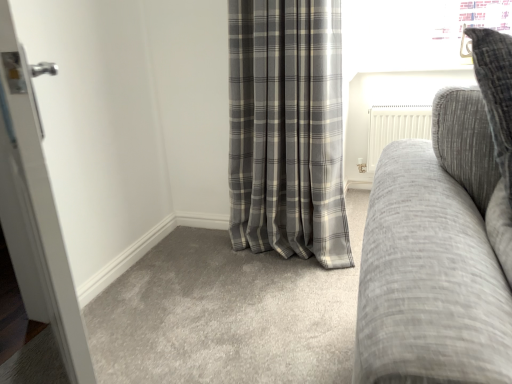
Question: Is gray plaid curtain at center wider than textured gray couch at right?

Choices:
 (A) yes
 (B) no

Answer: (B)

Question: Is gray plaid curtain at center facing towards textured gray couch at right?

Choices:
 (A) yes
 (B) no

Answer: (B)

Question: From a real-world perspective, is gray plaid curtain at center beneath textured gray couch at right?

Choices:
 (A) no
 (B) yes

Answer: (B)

Question: Is gray plaid curtain at center far away from textured gray couch at right?

Choices:
 (A) no
 (B) yes

Answer: (B)

Question: Can you confirm if gray plaid curtain at center is thinner than textured gray couch at right?

Choices:
 (A) yes
 (B) no

Answer: (A)

Question: From their relative heights in the image, would you say textured gray couch at right is taller or shorter than gray plaid curtain at center?

Choices:
 (A) tall
 (B) short

Answer: (B)

Question: Does point (382, 263) appear closer or farther from the camera than point (242, 112)?

Choices:
 (A) closer
 (B) farther

Answer: (A)

Question: From a real-world perspective, is textured gray couch at right positioned above or below gray plaid curtain at center?

Choices:
 (A) below
 (B) above

Answer: (B)

Question: Is textured gray couch at right inside the boundaries of gray plaid curtain at center, or outside?

Choices:
 (A) outside
 (B) inside

Answer: (A)

Question: In the image, is white glossy door at left positioned in front of or behind textured gray couch at right?

Choices:
 (A) behind
 (B) front

Answer: (A)

Question: Is white glossy door at left inside the boundaries of textured gray couch at right, or outside?

Choices:
 (A) inside
 (B) outside

Answer: (B)

Question: Does point (48, 256) appear closer or farther from the camera than point (456, 243)?

Choices:
 (A) closer
 (B) farther

Answer: (B)

Question: Looking at their shapes, would you say white glossy door at left is wider or thinner than textured gray couch at right?

Choices:
 (A) wide
 (B) thin

Answer: (B)

Question: Does point (267, 57) appear closer or farther from the camera than point (392, 264)?

Choices:
 (A) farther
 (B) closer

Answer: (A)

Question: Considering the positions of gray plaid curtain at center and textured gray couch at right in the image, is gray plaid curtain at center bigger or smaller than textured gray couch at right?

Choices:
 (A) big
 (B) small

Answer: (A)